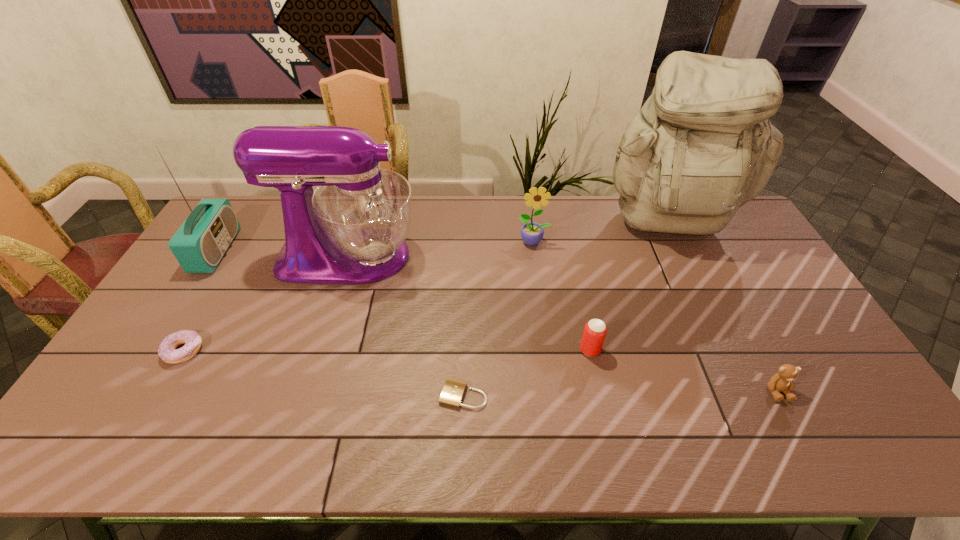
Find the location of a particular element. This screenshot has width=960, height=540. the fifth object from right to left is located at coordinates (453, 391).

Locate an element on the screen. The image size is (960, 540). the shortest object is located at coordinates (453, 391).

Locate an element on the screen. vacant space situated 0.340m on the front-facing side of the backpack is located at coordinates (724, 338).

The height and width of the screenshot is (540, 960). In order to click on vacant space positioned 0.060m at the bowl opening of the second tallest object in this screenshot , I will do `click(437, 256)`.

Find the location of `free spot located on the front panel of the third tallest object`. free spot located on the front panel of the third tallest object is located at coordinates (334, 251).

Where is `free location located on the front-facing side of the fifth object from left to right`? Image resolution: width=960 pixels, height=540 pixels. free location located on the front-facing side of the fifth object from left to right is located at coordinates (544, 325).

The width and height of the screenshot is (960, 540). I want to click on vacant point located 0.110m on the back of the fifth tallest object, so click(x=582, y=312).

Locate an element on the screen. The height and width of the screenshot is (540, 960). free space located 0.110m on the face of the sixth tallest object is located at coordinates 806,446.

Find the location of `free space located 0.190m on the back of the second shortest object`. free space located 0.190m on the back of the second shortest object is located at coordinates (221, 287).

Locate an element on the screen. This screenshot has width=960, height=540. blank area located on the left of the fourth object from left to right is located at coordinates (404, 395).